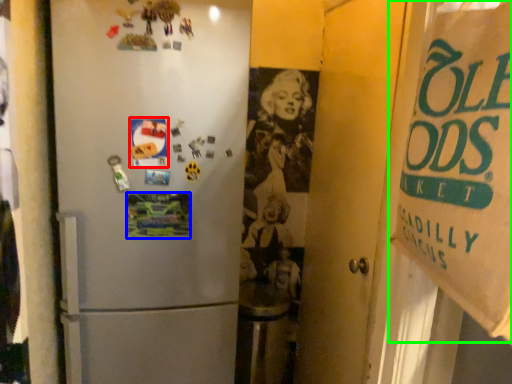
Question: Estimate the real-world distances between objects in this image. Which object is farther from postcard (highlighted by a red box), postcard (highlighted by a blue box) or poster (highlighted by a green box)?

Choices:
 (A) postcard
 (B) poster

Answer: (B)